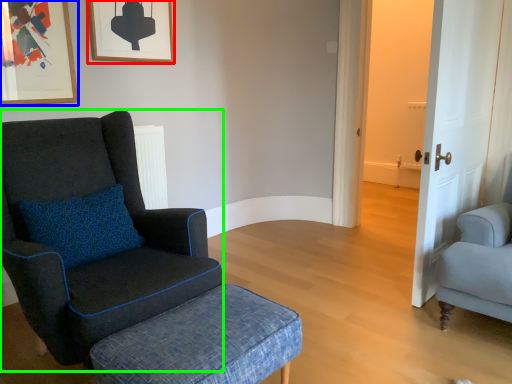
Question: Based on their relative distances, which object is farther from picture frame (highlighted by a red box)? Choose from picture frame (highlighted by a blue box) and chair (highlighted by a green box).

Choices:
 (A) picture frame
 (B) chair

Answer: (B)